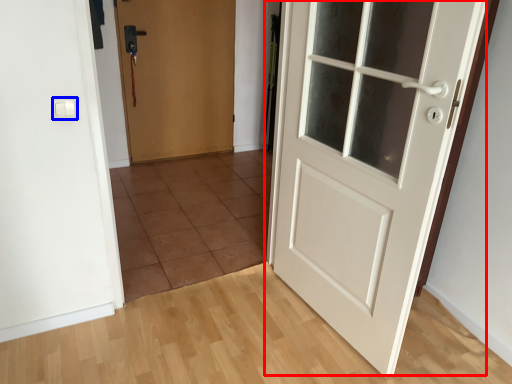
Question: Which point is further to the camera, door (highlighted by a red box) or light switch (highlighted by a blue box)?

Choices:
 (A) door
 (B) light switch

Answer: (B)